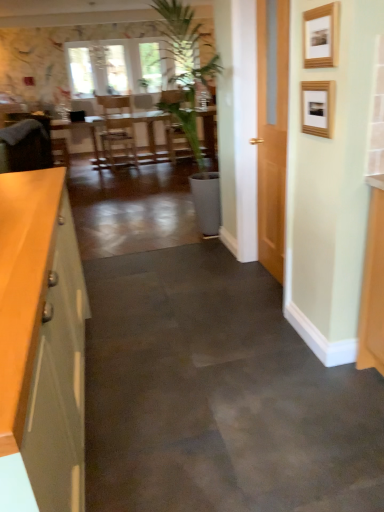
Locate an element on the screen. The width and height of the screenshot is (384, 512). wooden picture frame at upper right, acting as the first picture frame starting from the bottom is located at coordinates (318, 106).

Where is `wooden picture frame at upper right, placed as the second picture frame when sorted from bottom to top`? The image size is (384, 512). wooden picture frame at upper right, placed as the second picture frame when sorted from bottom to top is located at coordinates (321, 36).

Is wooden table at center oriented towards wooden picture frame at upper right, acting as the first picture frame starting from the top?

Yes, wooden table at center is oriented towards wooden picture frame at upper right, acting as the first picture frame starting from the top.

From a real-world perspective, is wooden table at center positioned over wooden picture frame at upper right, acting as the first picture frame starting from the top, based on gravity?

No, from a real-world perspective, wooden table at center is not above wooden picture frame at upper right, acting as the first picture frame starting from the top.

Does wooden table at center lie in front of wooden picture frame at upper right, acting as the first picture frame starting from the top?

No, wooden table at center is behind wooden picture frame at upper right, acting as the first picture frame starting from the top.

From the image's perspective, would you say wooden table at center is positioned over wooden picture frame at upper right, placed as the second picture frame when sorted from bottom to top?

Yes.

Can you confirm if matte gray cabinet at left is wider than wooden table at center?

In fact, matte gray cabinet at left might be narrower than wooden table at center.

Does matte gray cabinet at left appear on the right side of wooden table at center?

Yes, matte gray cabinet at left is to the right of wooden table at center.

Which is more distant, (x=80, y=459) or (x=136, y=114)?

The point (x=136, y=114) is behind.

Considering the relative sizes of matte gray cabinet at left and wooden table at center in the image provided, is matte gray cabinet at left shorter than wooden table at center?

Incorrect, the height of matte gray cabinet at left does not fall short of that of wooden table at center.

Is wooden picture frame at upper right, acting as the first picture frame starting from the top, taller than wooden picture frame at upper right, acting as the first picture frame starting from the bottom?

In fact, wooden picture frame at upper right, acting as the first picture frame starting from the top, may be shorter than wooden picture frame at upper right, acting as the first picture frame starting from the bottom.

Is wooden picture frame at upper right, acting as the first picture frame starting from the top, bigger than wooden picture frame at upper right, acting as the first picture frame starting from the bottom?

Indeed, wooden picture frame at upper right, acting as the first picture frame starting from the top, has a larger size compared to wooden picture frame at upper right, acting as the first picture frame starting from the bottom.

Does wooden picture frame at upper right, acting as the first picture frame starting from the top, lie behind wooden picture frame at upper right, which appears as the second picture frame when viewed from the top?

That is False.

Is wooden picture frame at upper right, acting as the first picture frame starting from the top, wider or thinner than wooden picture frame at upper right, acting as the first picture frame starting from the bottom?

Clearly, wooden picture frame at upper right, acting as the first picture frame starting from the top, has more width compared to wooden picture frame at upper right, acting as the first picture frame starting from the bottom.

Is matte gray cabinet at left next to wooden picture frame at upper right, acting as the first picture frame starting from the top, and touching it?

matte gray cabinet at left and wooden picture frame at upper right, acting as the first picture frame starting from the top, are not in contact.

Which is more to the right, matte gray cabinet at left or wooden picture frame at upper right, acting as the first picture frame starting from the top?

Positioned to the right is wooden picture frame at upper right, acting as the first picture frame starting from the top.

Is point (42, 440) behind point (307, 37)?

No, it is in front of (307, 37).

Consider the image. Measure the distance from matte gray cabinet at left to wooden picture frame at upper right, placed as the second picture frame when sorted from bottom to top.

The distance of matte gray cabinet at left from wooden picture frame at upper right, placed as the second picture frame when sorted from bottom to top, is 4.60 feet.

Can you tell me how much velvet brown armchair at left and wooden table at center differ in facing direction?

The angular difference between velvet brown armchair at left and wooden table at center is 91.9 degrees.

Is velvet brown armchair at left further to camera compared to wooden table at center?

No, it is in front of wooden table at center.

Considering the sizes of objects velvet brown armchair at left and wooden table at center in the image provided, who is wider, velvet brown armchair at left or wooden table at center?

With larger width is wooden table at center.

Choose the correct answer: Is velvet brown armchair at left inside wooden table at center or outside it?

velvet brown armchair at left is inside wooden table at center.

Looking at their sizes, would you say wooden picture frame at upper right, which appears as the second picture frame when viewed from the top, is wider or thinner than matte gray cabinet at left?

In the image, wooden picture frame at upper right, which appears as the second picture frame when viewed from the top, appears to be more narrow than matte gray cabinet at left.

What's the angular difference between wooden picture frame at upper right, acting as the first picture frame starting from the bottom, and matte gray cabinet at left's facing directions?

wooden picture frame at upper right, acting as the first picture frame starting from the bottom, and matte gray cabinet at left are facing 179 degrees away from each other.

Could you tell me if wooden picture frame at upper right, acting as the first picture frame starting from the bottom, is turned towards matte gray cabinet at left?

No.

Could matte gray cabinet at left be considered to be inside wooden picture frame at upper right, acting as the first picture frame starting from the bottom?

Actually, matte gray cabinet at left is outside wooden picture frame at upper right, acting as the first picture frame starting from the bottom.

Considering the relative positions of wooden picture frame at upper right, which appears as the second picture frame when viewed from the top, and wooden table at center in the image provided, is wooden picture frame at upper right, which appears as the second picture frame when viewed from the top, in front of wooden table at center?

Yes, wooden picture frame at upper right, which appears as the second picture frame when viewed from the top, is closer to the viewer.

Based on the photo, which point is more distant from viewer, (325, 118) or (151, 151)?

The point (151, 151) is farther.

This screenshot has width=384, height=512. I want to click on picture frame that is the 1st one when counting downward from the wooden table at center (from the image's perspective), so click(321, 36).

I want to click on table behind the matte gray cabinet at left, so click(x=148, y=125).

Which object lies nearer to the anchor point wooden table at center, wooden picture frame at upper right, placed as the second picture frame when sorted from bottom to top, or velvet brown armchair at left?

Among the two, velvet brown armchair at left is located nearer to wooden table at center.

Considering their positions, is velvet brown armchair at left positioned closer to wooden picture frame at upper right, placed as the second picture frame when sorted from bottom to top, than wooden picture frame at upper right, which appears as the second picture frame when viewed from the top?

The object closer to wooden picture frame at upper right, placed as the second picture frame when sorted from bottom to top, is wooden picture frame at upper right, which appears as the second picture frame when viewed from the top.

Based on their spatial positions, is wooden table at center or wooden picture frame at upper right, which appears as the second picture frame when viewed from the top, further from velvet brown armchair at left?

wooden table at center is further to velvet brown armchair at left.

When comparing their distances from wooden table at center, does wooden picture frame at upper right, acting as the first picture frame starting from the bottom, or wooden picture frame at upper right, acting as the first picture frame starting from the top, seem closer?

wooden picture frame at upper right, acting as the first picture frame starting from the bottom, is closer to wooden table at center.

Looking at the image, which one is located further to wooden picture frame at upper right, placed as the second picture frame when sorted from bottom to top, velvet brown armchair at left or matte gray cabinet at left?

velvet brown armchair at left.

Based on their spatial positions, is velvet brown armchair at left or wooden picture frame at upper right, acting as the first picture frame starting from the top, closer to wooden picture frame at upper right, acting as the first picture frame starting from the bottom?

wooden picture frame at upper right, acting as the first picture frame starting from the top, lies closer to wooden picture frame at upper right, acting as the first picture frame starting from the bottom, than the other object.

Looking at the image, which one is located further to wooden picture frame at upper right, placed as the second picture frame when sorted from bottom to top, wooden table at center or velvet brown armchair at left?

The object further to wooden picture frame at upper right, placed as the second picture frame when sorted from bottom to top, is wooden table at center.

When comparing their distances from wooden table at center, does matte gray cabinet at left or wooden picture frame at upper right, placed as the second picture frame when sorted from bottom to top, seem closer?

wooden picture frame at upper right, placed as the second picture frame when sorted from bottom to top, is positioned closer to the anchor wooden table at center.

You are a GUI agent. You are given a task and a screenshot of the screen. Output one action in this format:
    pyautogui.click(x=<x>, y=<y>)
    Task: Click on the armchair located between matte gray cabinet at left and wooden table at center in the depth direction
    Image resolution: width=384 pixels, height=512 pixels.
    Given the screenshot: What is the action you would take?
    [x=30, y=144]

Find the location of `picture frame between matte gray cabinet at left and wooden picture frame at upper right, acting as the first picture frame starting from the bottom, from left to right`. picture frame between matte gray cabinet at left and wooden picture frame at upper right, acting as the first picture frame starting from the bottom, from left to right is located at coordinates (321, 36).

I want to click on picture frame located between wooden picture frame at upper right, acting as the first picture frame starting from the top, and wooden table at center in the depth direction, so click(x=318, y=106).

The height and width of the screenshot is (512, 384). In order to click on picture frame between wooden picture frame at upper right, acting as the first picture frame starting from the top, and velvet brown armchair at left in the front-back direction in this screenshot , I will do `click(318, 106)`.